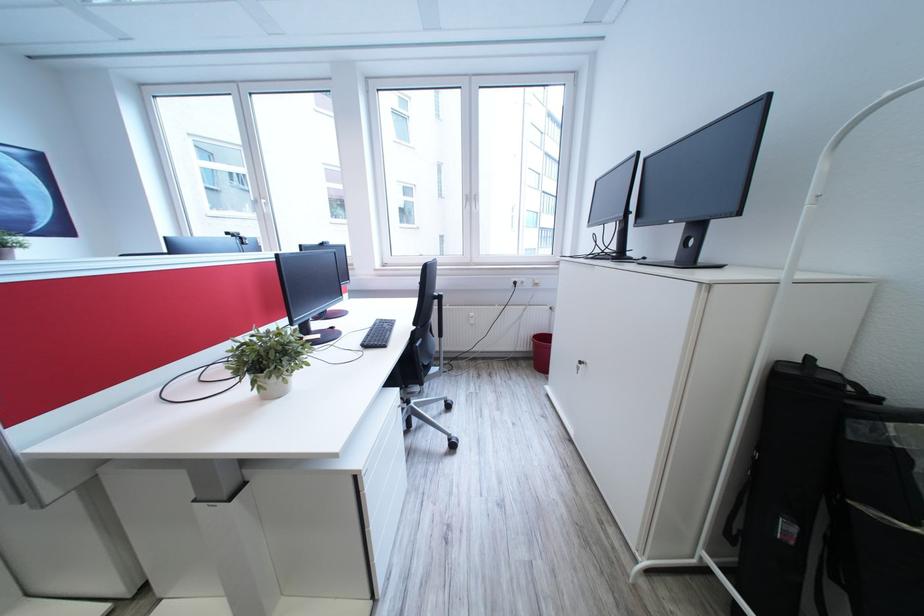
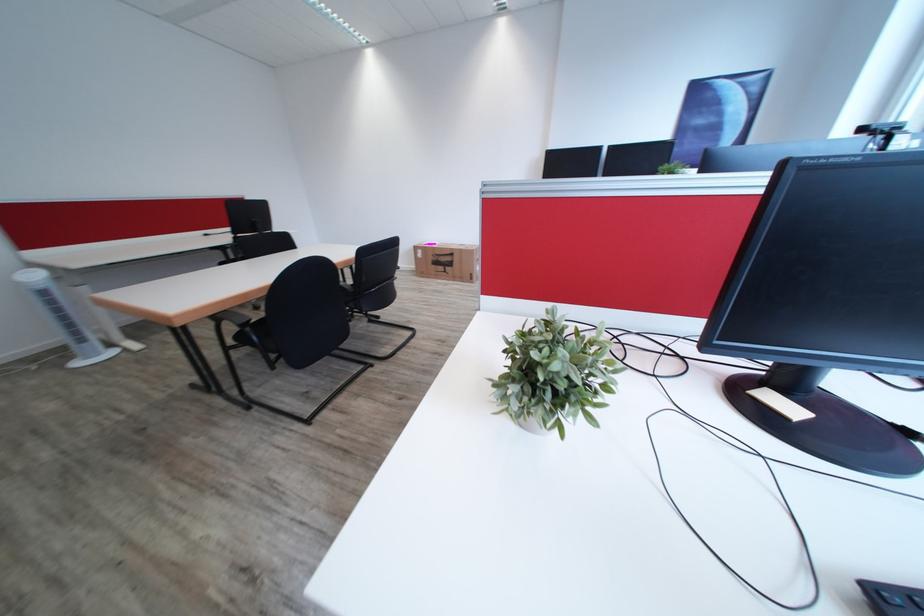
How did the camera likely rotate?

The camera's rotation is toward left-down.